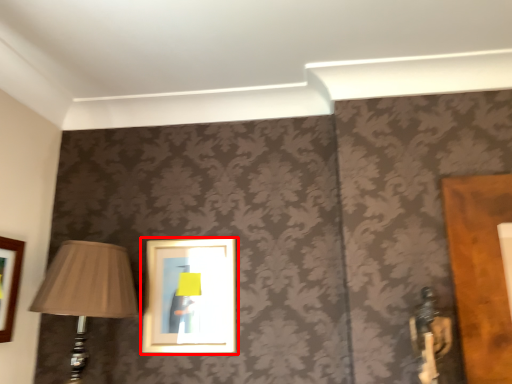
Question: From the image's perspective, considering the relative positions of picture frame (annotated by the red box) and lamp in the image provided, where is picture frame (annotated by the red box) located with respect to the staircase?

Choices:
 (A) above
 (B) below

Answer: (A)